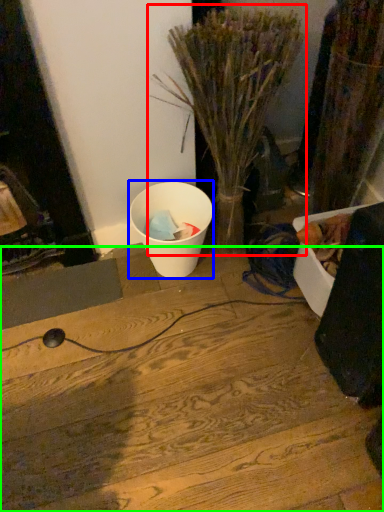
Question: Considering the real-world distances, which object is closest to houseplant (highlighted by a red box)? waste (highlighted by a blue box) or wood (highlighted by a green box).

Choices:
 (A) waste
 (B) wood

Answer: (A)